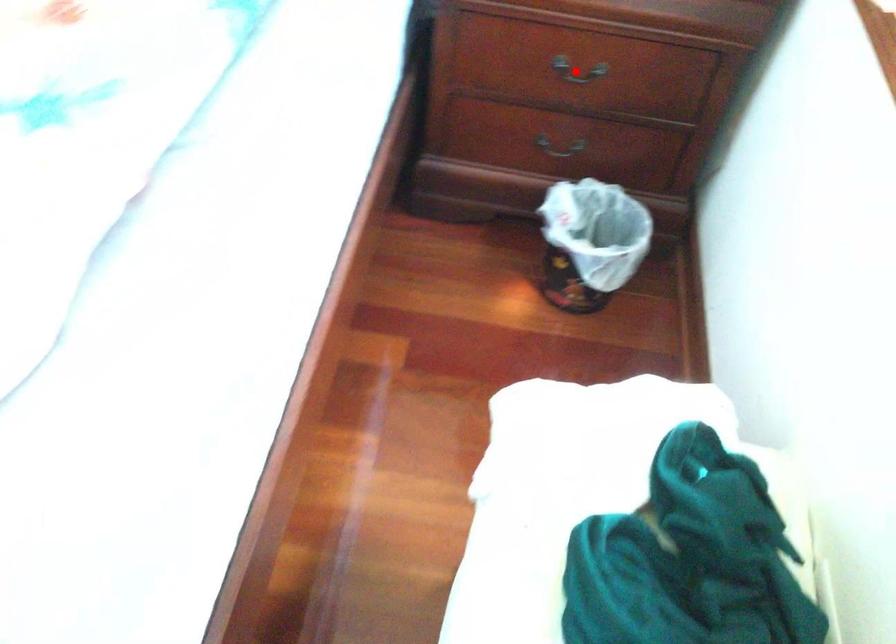
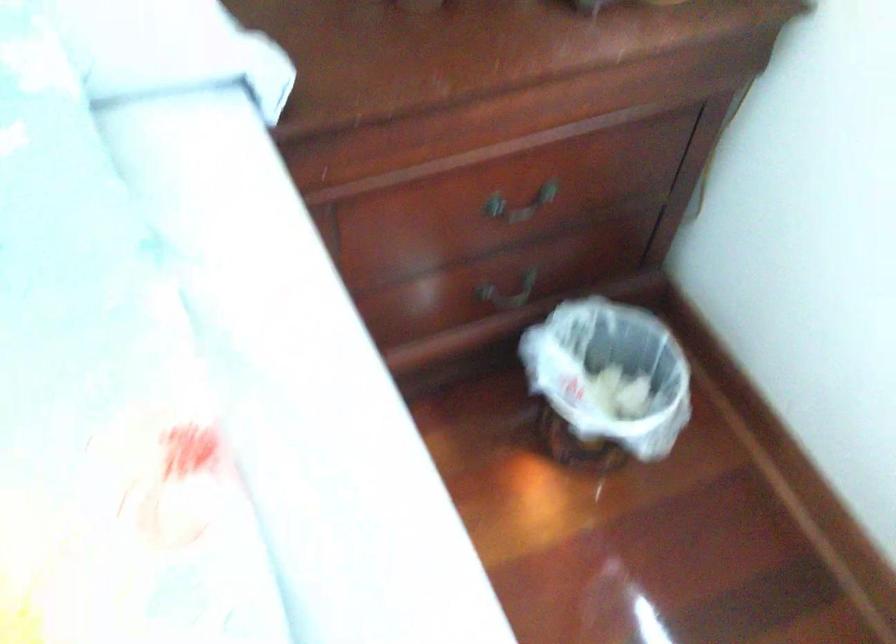
Question: I am providing you with two images of the same scene from different viewpoints. A red point is shown in image1. For the corresponding object point in image2, is it positioned nearer or farther from the camera?

Choices:
 (A) Nearer
 (B) Farther

Answer: (A)